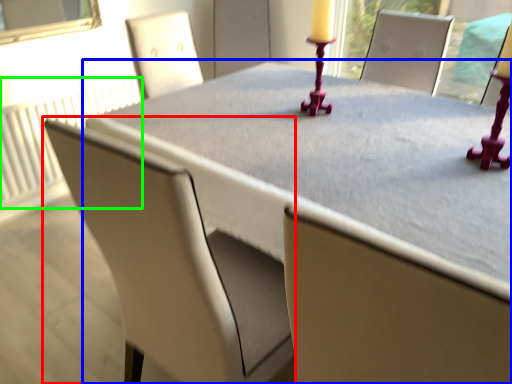
Question: Estimate the real-world distances between objects in this image. Which object is farther from chair (highlighted by a red box), table (highlighted by a blue box) or radiator (highlighted by a green box)?

Choices:
 (A) table
 (B) radiator

Answer: (B)